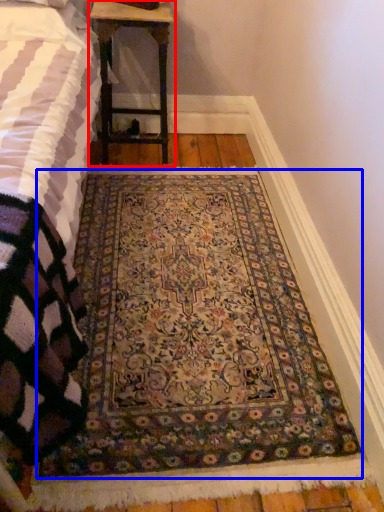
Question: Which of the following is the farthest to the observer, table (highlighted by a red box) or mat (highlighted by a blue box)?

Choices:
 (A) table
 (B) mat

Answer: (A)